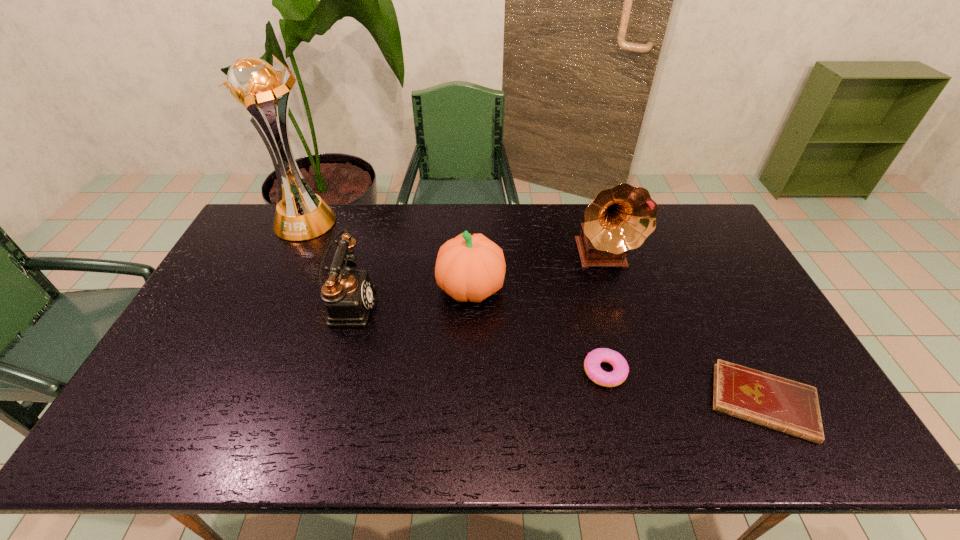
Find the location of a particular element. object that is positioned at the near right corner is located at coordinates (771, 401).

This screenshot has width=960, height=540. In the image, there is a desktop. Find the location of `vacant area at the far edge`. vacant area at the far edge is located at coordinates (415, 216).

This screenshot has width=960, height=540. In order to click on free space at the left edge in this screenshot , I will do `click(198, 363)`.

Locate an element on the screen. The width and height of the screenshot is (960, 540). free region at the right edge is located at coordinates (742, 289).

The width and height of the screenshot is (960, 540). I want to click on vacant space at the near left corner of the desktop, so click(x=127, y=433).

In the image, there is a desktop. Where is `vacant region at the far right corner`? vacant region at the far right corner is located at coordinates (709, 230).

The height and width of the screenshot is (540, 960). Find the location of `vacant area between the doughnut and the telephone`. vacant area between the doughnut and the telephone is located at coordinates (476, 338).

Where is `free area in between the second shortest object and the rightmost object`? The width and height of the screenshot is (960, 540). free area in between the second shortest object and the rightmost object is located at coordinates (684, 387).

The image size is (960, 540). I want to click on vacant area between the rightmost object and the second shortest object, so click(684, 387).

You are a GUI agent. You are given a task and a screenshot of the screen. Output one action in this format:
    pyautogui.click(x=<x>, y=<y>)
    Task: Click on the blank region between the second shortest object and the third object from left to right
    Image resolution: width=960 pixels, height=540 pixels.
    Given the screenshot: What is the action you would take?
    pyautogui.click(x=538, y=330)